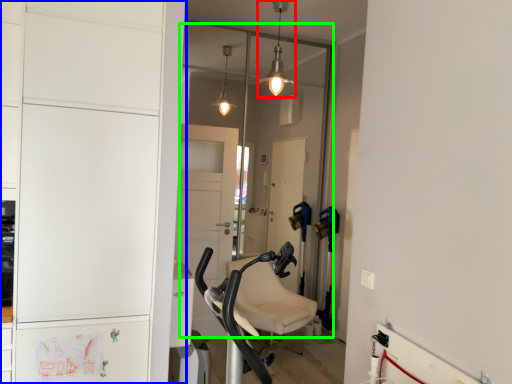
Question: Which object is positioned closest to light fixture (highlighted by a red box)? Select from cabinetry (highlighted by a blue box) and glass door (highlighted by a green box).

Choices:
 (A) cabinetry
 (B) glass door

Answer: (B)